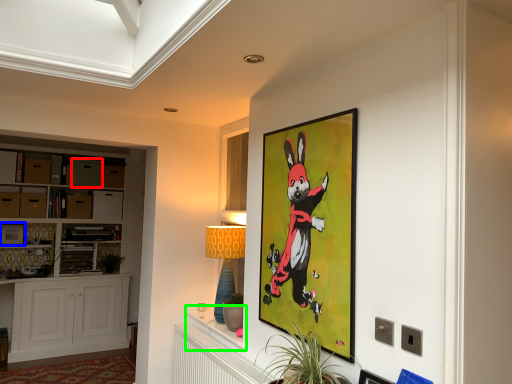
Question: Which object is the farthest from drawer (highlighted by a red box)? Choose among these: picture frame (highlighted by a blue box) or table (highlighted by a green box).

Choices:
 (A) picture frame
 (B) table

Answer: (B)